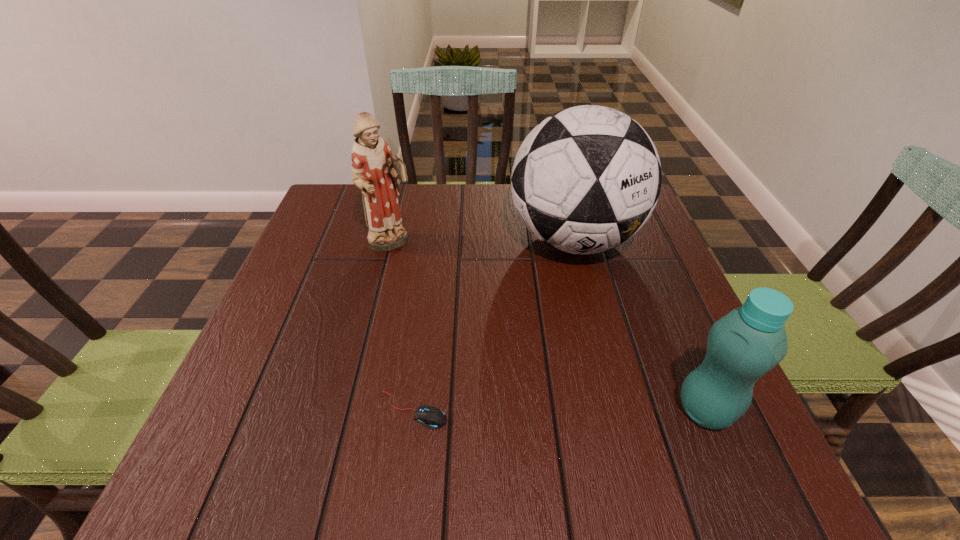
Find the location of `free space on the desktop that is between the shortest object and the third tallest object and is positioned on the surface of the soccer ball where the brand logo is visible`. free space on the desktop that is between the shortest object and the third tallest object and is positioned on the surface of the soccer ball where the brand logo is visible is located at coordinates (598, 410).

Identify the location of free spot on the desktop that is between the mouse and the third tallest object and is positioned on the front-facing side of the figurine. This screenshot has height=540, width=960. (584, 410).